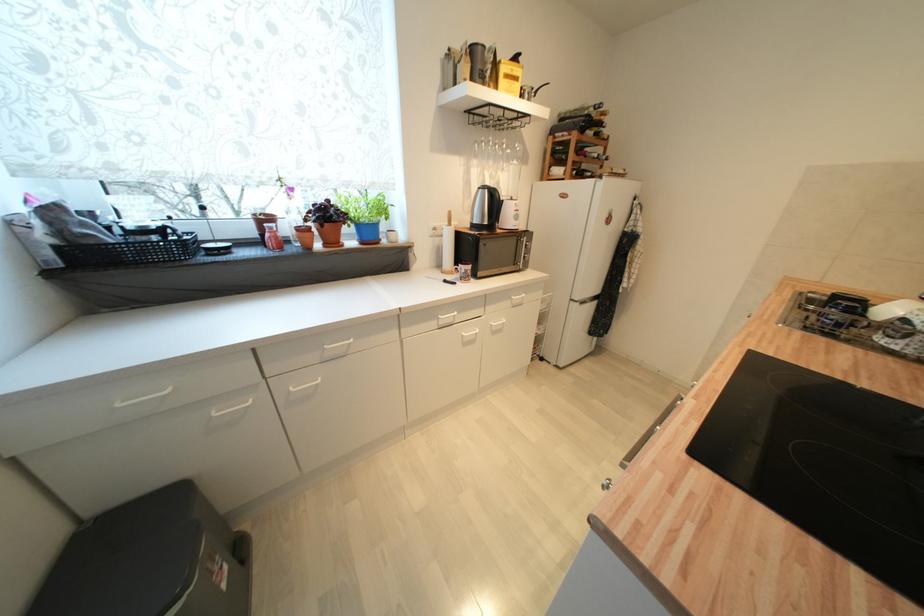
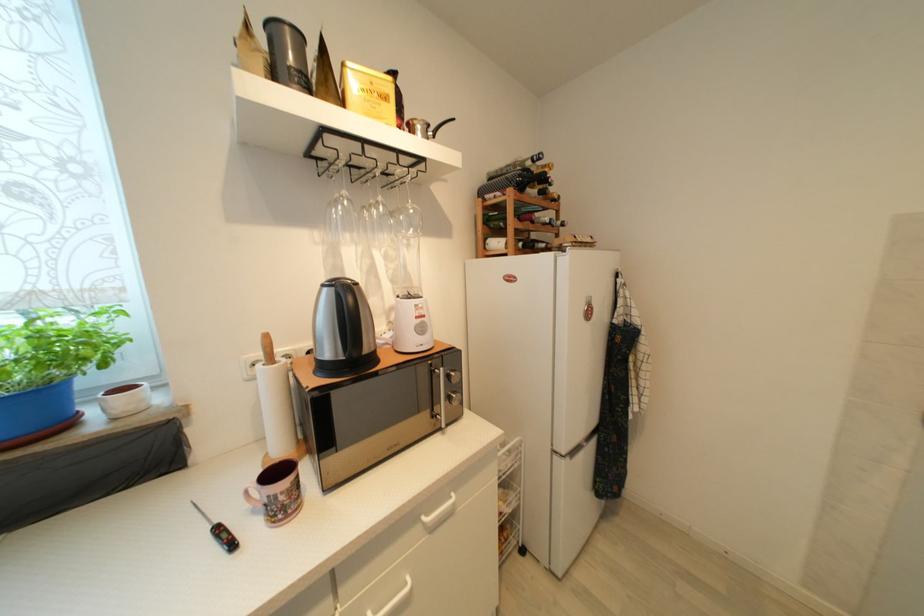
Find the pixel in the second image that matches (591,134) in the first image.

(533, 192)